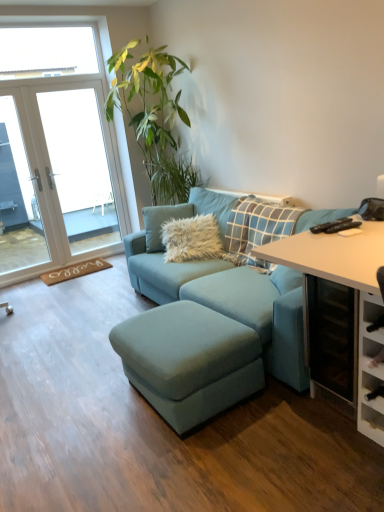
Question: Is white glossy table at right bigger than white glass door at left?

Choices:
 (A) no
 (B) yes

Answer: (A)

Question: From the image's perspective, is white glossy table at right above white glass door at left?

Choices:
 (A) yes
 (B) no

Answer: (B)

Question: Does white glossy table at right turn towards white glass door at left?

Choices:
 (A) yes
 (B) no

Answer: (B)

Question: Is white glossy table at right smaller than white glass door at left?

Choices:
 (A) yes
 (B) no

Answer: (A)

Question: Considering the relative sizes of white glossy table at right and white glass door at left in the image provided, is white glossy table at right thinner than white glass door at left?

Choices:
 (A) no
 (B) yes

Answer: (A)

Question: Is white glass door at left completely or partially inside white glossy table at right?

Choices:
 (A) yes
 (B) no

Answer: (B)

Question: Does suede blue footrest at center have a lesser height compared to fuzzy white pillow at center?

Choices:
 (A) yes
 (B) no

Answer: (A)

Question: Is suede blue footrest at center outside of fuzzy white pillow at center?

Choices:
 (A) yes
 (B) no

Answer: (A)

Question: Does suede blue footrest at center have a larger size compared to fuzzy white pillow at center?

Choices:
 (A) no
 (B) yes

Answer: (B)

Question: From a real-world perspective, does suede blue footrest at center stand above fuzzy white pillow at center?

Choices:
 (A) yes
 (B) no

Answer: (B)

Question: From the image's perspective, is suede blue footrest at center below fuzzy white pillow at center?

Choices:
 (A) no
 (B) yes

Answer: (B)

Question: From a real-world perspective, is suede blue footrest at center below fuzzy white pillow at center?

Choices:
 (A) yes
 (B) no

Answer: (A)

Question: From the image's perspective, is fuzzy white pillow at center over white glass door at upper left?

Choices:
 (A) yes
 (B) no

Answer: (B)